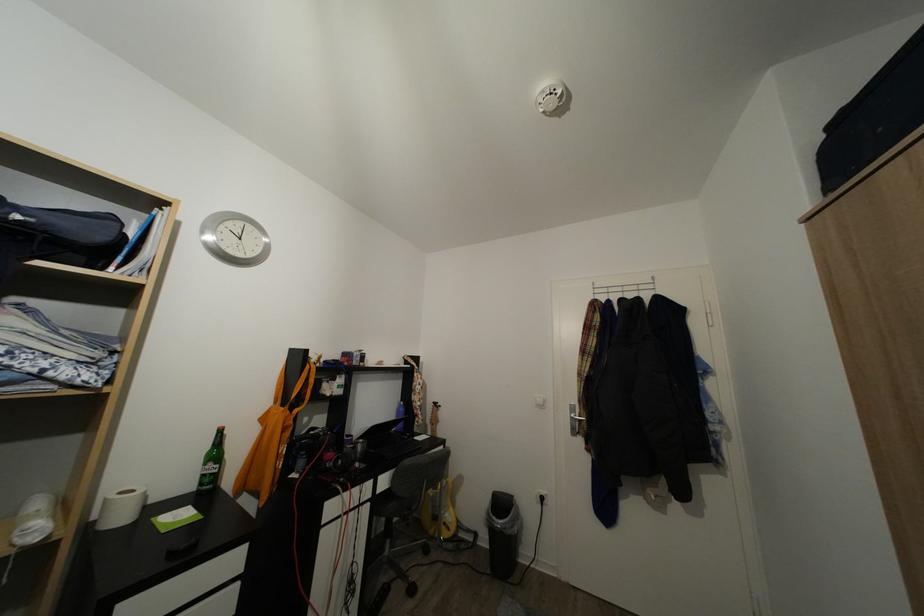
Locate an element on the screen. power outlet socket is located at coordinates (541, 496).